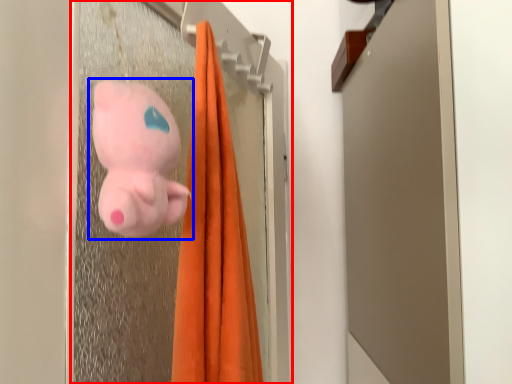
Question: Among these objects, which one is nearest to the camera, screen door (highlighted by a red box) or toy (highlighted by a blue box)?

Choices:
 (A) screen door
 (B) toy

Answer: (A)